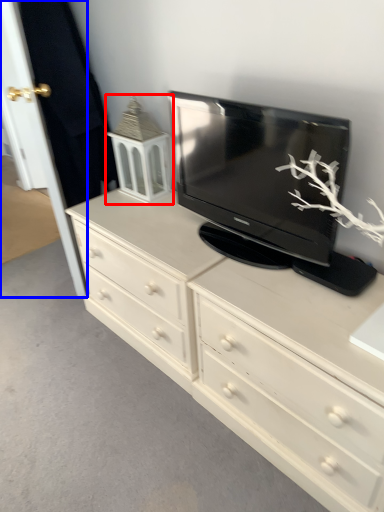
Question: Among these objects, which one is nearest to the camera, tv cabinet (highlighted by a red box) or door (highlighted by a blue box)?

Choices:
 (A) tv cabinet
 (B) door

Answer: (B)